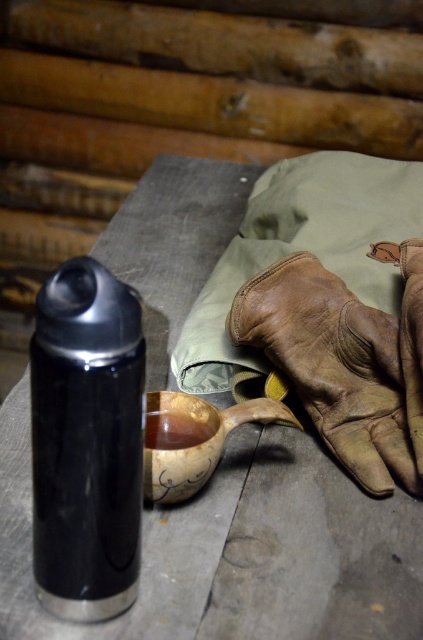
You are standing in front of the rustic cabin interior scene. There are two points marked in the image. The first point is at coordinates point (x=60, y=317) and the second point is at point (x=400, y=365). Which of these two points is closer to you?

Point (x=60, y=317) is closer to the camera than point (x=400, y=365).

You are organizing items on a table in a rustic cabin. You have a brown leather glove at center and a wooden carved cup at center. Where should you place the glove relative to the cup to maintain the current arrangement?

The brown leather glove at center should be placed on the right side of the wooden carved cup at center to maintain the current arrangement.